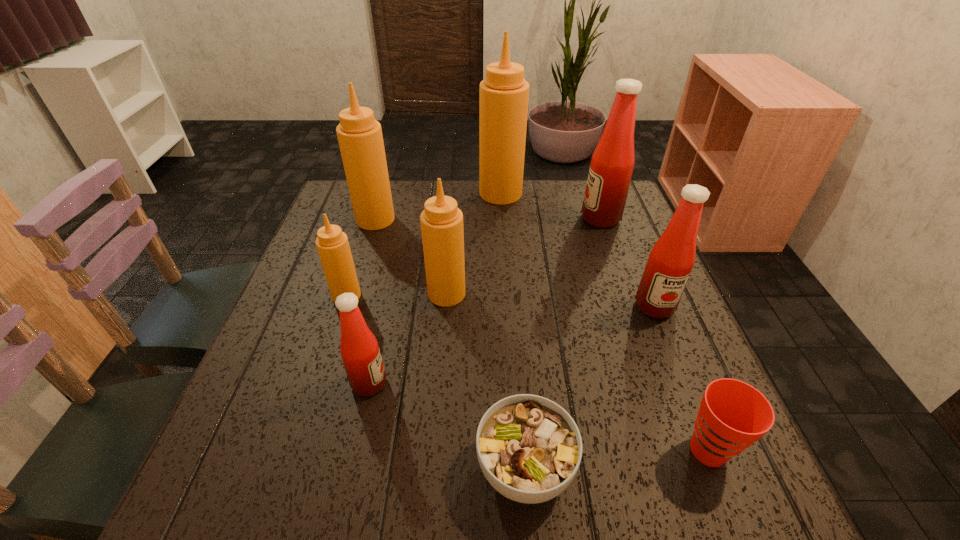
I want to click on vacant space located 0.050m on the right of the smallest tan condiment, so click(382, 296).

Identify the location of free spot located on the front-facing side of the leftmost red condiment. (428, 383).

This screenshot has height=540, width=960. I want to click on vacant space situated on the left of the cup, so click(520, 450).

At what (x,y) coordinates should I click in order to perform the action: click on vacant space situated 0.130m on the left of the shortest object. Please return your answer as a coordinate pair (x, y). This screenshot has height=540, width=960. Looking at the image, I should click on (396, 468).

The image size is (960, 540). I want to click on cup at the near edge, so click(x=733, y=415).

Image resolution: width=960 pixels, height=540 pixels. What are the coordinates of `soup bowl that is at the near edge` in the screenshot? It's located at (529, 448).

What are the coordinates of `cup at the right edge` in the screenshot? It's located at (733, 415).

What are the coordinates of `object positioned at the far left corner` in the screenshot? It's located at (360, 138).

At what (x,y) coordinates should I click in order to perform the action: click on object situated at the far right corner. Please return your answer as a coordinate pair (x, y). The width and height of the screenshot is (960, 540). Looking at the image, I should click on (612, 163).

This screenshot has width=960, height=540. In order to click on object located in the near right corner section of the desktop in this screenshot , I will do click(x=733, y=415).